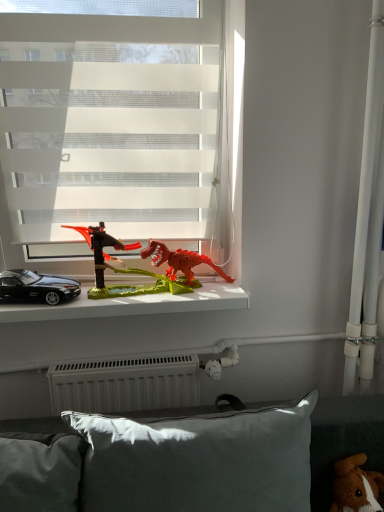
Locate an element on the screen. This screenshot has height=512, width=384. white translucent blinds at upper center is located at coordinates (109, 123).

Image resolution: width=384 pixels, height=512 pixels. Identify the location of rubberized red dinosaur at center, which is counted as the first toy, starting from the left. (124, 268).

Where is `black plastic car at left`? The width and height of the screenshot is (384, 512). black plastic car at left is located at coordinates (132, 304).

At what (x,y) coordinates should I click in order to perform the action: click on gray fabric pillow at lower center. Please return your answer as a coordinate pair (x, y). Image resolution: width=384 pixels, height=512 pixels. Looking at the image, I should click on (198, 461).

Identify the location of white translucent blinds at upper center. The width and height of the screenshot is (384, 512). click(109, 123).

Considering their positions, is white translucent blinds at upper center located in front of or behind black plastic car at left?

Visually, white translucent blinds at upper center is located in front of black plastic car at left.

Does white translucent blinds at upper center have a greater width compared to black plastic car at left?

No, white translucent blinds at upper center is not wider than black plastic car at left.

Does white translucent blinds at upper center have a larger size compared to black plastic car at left?

Correct, white translucent blinds at upper center is larger in size than black plastic car at left.

Which is nearer, (125, 124) or (60, 310)?

Point (125, 124) is positioned farther from the camera compared to point (60, 310).

Is rubberized red dinosaur at center, which is the 2th toy from bottom to top, positioned in front of gray fabric pillow at lower center?

No, it is not.

Considering the relative sizes of rubberized red dinosaur at center, positioned as the second toy in right-to-left order, and gray fabric pillow at lower center in the image provided, is rubberized red dinosaur at center, positioned as the second toy in right-to-left order, shorter than gray fabric pillow at lower center?

Yes.

Would you say rubberized red dinosaur at center, positioned as the 1th toy in top-to-bottom order, is to the left or to the right of gray fabric pillow at lower center in the picture?

rubberized red dinosaur at center, positioned as the 1th toy in top-to-bottom order, is to the left of gray fabric pillow at lower center.

Is rubberized red dinosaur at center, positioned as the 1th toy in top-to-bottom order, oriented towards gray fabric pillow at lower center?

No, rubberized red dinosaur at center, positioned as the 1th toy in top-to-bottom order, is not aimed at gray fabric pillow at lower center.

Considering the relative positions of rubberized red dinosaur at center, placed as the first toy when sorted from back to front, and black plastic car at left in the image provided, is rubberized red dinosaur at center, placed as the first toy when sorted from back to front, to the left of black plastic car at left from the viewer's perspective?

In fact, rubberized red dinosaur at center, placed as the first toy when sorted from back to front, is to the right of black plastic car at left.

Considering their positions, is rubberized red dinosaur at center, positioned as the second toy in right-to-left order, located in front of or behind black plastic car at left?

rubberized red dinosaur at center, positioned as the second toy in right-to-left order, is positioned closer to the viewer than black plastic car at left.

Does rubberized red dinosaur at center, which is the 2th toy from bottom to top, have a lesser width compared to black plastic car at left?

Yes, rubberized red dinosaur at center, which is the 2th toy from bottom to top, is thinner than black plastic car at left.

Does point (96, 290) lie in front of point (85, 289)?

That is True.

Is black plastic car at left smaller than rubberized red dinosaur at center, positioned as the second toy in right-to-left order?

Yes, black plastic car at left is smaller than rubberized red dinosaur at center, positioned as the second toy in right-to-left order.

Is black plastic car at left at the left side of rubberized red dinosaur at center, placed as the first toy when sorted from back to front?

Indeed, black plastic car at left is positioned on the left side of rubberized red dinosaur at center, placed as the first toy when sorted from back to front.

Which of these two, black plastic car at left or rubberized red dinosaur at center, placed as the first toy when sorted from back to front, is wider?

black plastic car at left.

Is black plastic car at left in front of or behind rubberized red dinosaur at center, positioned as the 1th toy in top-to-bottom order, in the image?

Clearly, black plastic car at left is behind rubberized red dinosaur at center, positioned as the 1th toy in top-to-bottom order.

How far apart are white translucent blinds at upper center and rubberized red dinosaur at center, which is counted as the first toy, starting from the left?

white translucent blinds at upper center and rubberized red dinosaur at center, which is counted as the first toy, starting from the left, are 11.71 inches apart.

Is white translucent blinds at upper center placed right next to rubberized red dinosaur at center, the second toy positioned from the front?

There is a gap between white translucent blinds at upper center and rubberized red dinosaur at center, the second toy positioned from the front.

From the image's perspective, is white translucent blinds at upper center positioned above or below rubberized red dinosaur at center, the second toy positioned from the front?

Clearly, from the image's perspective, white translucent blinds at upper center is above rubberized red dinosaur at center, the second toy positioned from the front.

Is white translucent blinds at upper center inside or outside of rubberized red dinosaur at center, which is counted as the first toy, starting from the left?

white translucent blinds at upper center exists outside the volume of rubberized red dinosaur at center, which is counted as the first toy, starting from the left.

Is point (330, 509) positioned before point (137, 274)?

Yes, point (330, 509) is closer to viewer.

Is the position of brown plush toy at lower right, the 1th toy viewed from the right, less distant than that of rubberized red dinosaur at center, which is the 2th toy from bottom to top?

Yes.

Which object is positioned more to the right, brown plush toy at lower right, the 2th toy from the back, or rubberized red dinosaur at center, placed as the first toy when sorted from back to front?

brown plush toy at lower right, the 2th toy from the back.

From a real-world perspective, relative to rubberized red dinosaur at center, which is counted as the first toy, starting from the left, is brown plush toy at lower right, which is counted as the second toy, starting from the top, vertically above or below?

Clearly, from a real-world perspective, brown plush toy at lower right, which is counted as the second toy, starting from the top, is below rubberized red dinosaur at center, which is counted as the first toy, starting from the left.

Is the position of black plastic car at left more distant than that of white translucent blinds at upper center?

Yes, black plastic car at left is behind white translucent blinds at upper center.

From the image's perspective, is black plastic car at left below white translucent blinds at upper center?

Yes, from the image's perspective, black plastic car at left is beneath white translucent blinds at upper center.

Is black plastic car at left smaller than white translucent blinds at upper center?

Correct, black plastic car at left occupies less space than white translucent blinds at upper center.

Can you confirm if black plastic car at left is thinner than white translucent blinds at upper center?

Incorrect, the width of black plastic car at left is not less than that of white translucent blinds at upper center.

This screenshot has width=384, height=512. I want to click on window on the left of black plastic car at left, so click(x=109, y=123).

What are the coordinates of `pillow on the right of rubberized red dinosaur at center, which is counted as the first toy, starting from the left` in the screenshot? It's located at (198, 461).

Based on their spatial positions, is white translucent blinds at upper center or black matte car at left closer to black plastic car at left?

black matte car at left lies closer to black plastic car at left than the other object.

Looking at the image, which one is located further to gray fabric pillow at lower center, brown plush toy at lower right, which is counted as the second toy, starting from the top, or rubberized red dinosaur at center, the second toy positioned from the front?

rubberized red dinosaur at center, the second toy positioned from the front.

Based on their spatial positions, is black plastic car at left or gray fabric pillow at lower center closer to brown plush toy at lower right, the 2th toy from the back?

gray fabric pillow at lower center is closer to brown plush toy at lower right, the 2th toy from the back.

When comparing their distances from rubberized red dinosaur at center, the second toy positioned from the front, does gray fabric pillow at lower center or white translucent blinds at upper center seem further?

gray fabric pillow at lower center lies further to rubberized red dinosaur at center, the second toy positioned from the front, than the other object.

When comparing their distances from black plastic car at left, does black matte car at left or rubberized red dinosaur at center, the second toy positioned from the front, seem closer?

rubberized red dinosaur at center, the second toy positioned from the front, lies closer to black plastic car at left than the other object.

Which object lies further to the anchor point black matte car at left, rubberized red dinosaur at center, the second toy positioned from the front, or white translucent blinds at upper center?

The object further to black matte car at left is white translucent blinds at upper center.

When comparing their distances from rubberized red dinosaur at center, the second toy positioned from the front, does white translucent blinds at upper center or brown plush toy at lower right, which is counted as the second toy, starting from the top, seem further?

Among the two, brown plush toy at lower right, which is counted as the second toy, starting from the top, is located further to rubberized red dinosaur at center, the second toy positioned from the front.

Based on the photo, which object lies nearer to the anchor point black matte car at left, white translucent blinds at upper center or brown plush toy at lower right, the 2th toy from the back?

white translucent blinds at upper center.

Identify the location of car between white translucent blinds at upper center and gray fabric pillow at lower center in the vertical direction. (37, 287).

Find the location of a particular element. toy between white translucent blinds at upper center and black matte car at left vertically is located at coordinates (124, 268).

Where is `window sill between white translucent blinds at upper center and brown plush toy at lower right, which is counted as the second toy, starting from the top, vertically`? Image resolution: width=384 pixels, height=512 pixels. window sill between white translucent blinds at upper center and brown plush toy at lower right, which is counted as the second toy, starting from the top, vertically is located at coordinates (132, 304).

Identify the location of pillow that lies between white translucent blinds at upper center and brown plush toy at lower right, placed as the 2th toy when sorted from left to right, from top to bottom. The width and height of the screenshot is (384, 512). point(198,461).